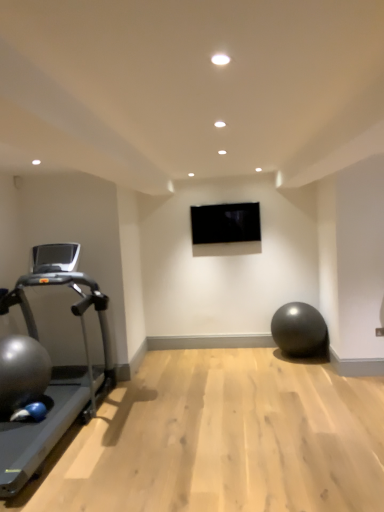
Question: Considering the relative positions of shiny metallic ball at left, the first ball positioned from the front, and silver metallic treadmill at left in the image provided, is shiny metallic ball at left, the first ball positioned from the front, to the left of silver metallic treadmill at left from the viewer's perspective?

Choices:
 (A) no
 (B) yes

Answer: (B)

Question: Does shiny metallic ball at left, the second ball positioned from the back, have a lesser height compared to silver metallic treadmill at left?

Choices:
 (A) no
 (B) yes

Answer: (B)

Question: From a real-world perspective, is shiny metallic ball at left, which appears as the second ball when viewed from the right, over silver metallic treadmill at left?

Choices:
 (A) yes
 (B) no

Answer: (B)

Question: Does shiny metallic ball at left, the first ball positioned from the front, appear on the right side of silver metallic treadmill at left?

Choices:
 (A) no
 (B) yes

Answer: (A)

Question: Can you confirm if shiny metallic ball at left, which is the first ball in left-to-right order, is taller than silver metallic treadmill at left?

Choices:
 (A) no
 (B) yes

Answer: (A)

Question: Can you confirm if shiny metallic ball at left, which appears as the second ball when viewed from the right, is smaller than silver metallic treadmill at left?

Choices:
 (A) no
 (B) yes

Answer: (B)

Question: Does silver metallic treadmill at left turn towards black glossy tv at center?

Choices:
 (A) no
 (B) yes

Answer: (A)

Question: From a real-world perspective, is silver metallic treadmill at left under black glossy tv at center?

Choices:
 (A) yes
 (B) no

Answer: (A)

Question: From a real-world perspective, is silver metallic treadmill at left on black glossy tv at center?

Choices:
 (A) no
 (B) yes

Answer: (A)

Question: Can you confirm if silver metallic treadmill at left is smaller than black glossy tv at center?

Choices:
 (A) no
 (B) yes

Answer: (A)

Question: Is silver metallic treadmill at left oriented away from black glossy tv at center?

Choices:
 (A) yes
 (B) no

Answer: (B)

Question: Is the position of silver metallic treadmill at left more distant than that of black glossy tv at center?

Choices:
 (A) no
 (B) yes

Answer: (A)

Question: From the image's perspective, is matte black ball at lower right, marked as the first ball in a back-to-front arrangement, under silver metallic treadmill at left?

Choices:
 (A) yes
 (B) no

Answer: (A)